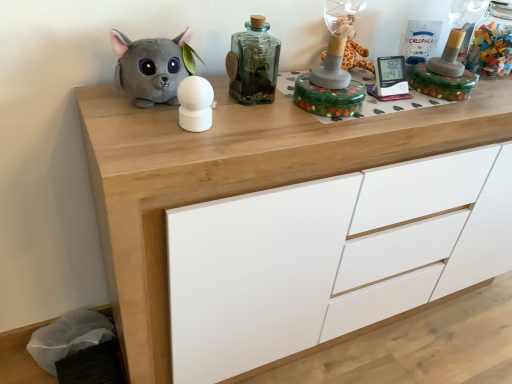
Question: From the image's perspective, is gray plush toy at left, which ranks as the 1th toy in left-to-right order, on wooden chest of drawers at center?

Choices:
 (A) yes
 (B) no

Answer: (A)

Question: Considering the relative sizes of gray plush toy at left, which ranks as the 1th toy in left-to-right order, and wooden chest of drawers at center in the image provided, is gray plush toy at left, which ranks as the 1th toy in left-to-right order, bigger than wooden chest of drawers at center?

Choices:
 (A) no
 (B) yes

Answer: (A)

Question: Is gray plush toy at left, the third toy in the right-to-left sequence, positioned in front of wooden chest of drawers at center?

Choices:
 (A) yes
 (B) no

Answer: (B)

Question: Is gray plush toy at left, which ranks as the 1th toy in left-to-right order, at the right side of wooden chest of drawers at center?

Choices:
 (A) no
 (B) yes

Answer: (A)

Question: Considering the relative positions of gray plush toy at left, the third toy in the right-to-left sequence, and wooden chest of drawers at center in the image provided, is gray plush toy at left, the third toy in the right-to-left sequence, behind wooden chest of drawers at center?

Choices:
 (A) no
 (B) yes

Answer: (B)

Question: Does point (163, 74) appear closer or farther from the camera than point (257, 29)?

Choices:
 (A) closer
 (B) farther

Answer: (A)

Question: From the image's perspective, relative to translucent glass bottle at center, the first bottle when ordered from left to right, is gray plush toy at left, the third toy in the right-to-left sequence, above or below?

Choices:
 (A) above
 (B) below

Answer: (B)

Question: Based on their positions, is gray plush toy at left, which ranks as the 1th toy in left-to-right order, located to the left or right of translucent glass bottle at center, marked as the second bottle in a right-to-left arrangement?

Choices:
 (A) left
 (B) right

Answer: (A)

Question: Is gray plush toy at left, the third toy in the right-to-left sequence, bigger or smaller than translucent glass bottle at center, the 2th bottle when ordered from back to front?

Choices:
 (A) small
 (B) big

Answer: (B)

Question: In terms of size, does green floral box at center, acting as the 1th toy starting from the right, appear bigger or smaller than translucent glass bottle at center, the 1th bottle positioned from the front?

Choices:
 (A) small
 (B) big

Answer: (B)

Question: From a real-world perspective, is green floral box at center, acting as the 1th toy starting from the right, positioned above or below translucent glass bottle at center, the 2th bottle when ordered from back to front?

Choices:
 (A) above
 (B) below

Answer: (B)

Question: In the image, is green floral box at center, acting as the 1th toy starting from the right, positioned in front of or behind translucent glass bottle at center, the 2th bottle when ordered from back to front?

Choices:
 (A) front
 (B) behind

Answer: (A)

Question: Is green floral box at center, acting as the 1th toy starting from the right, inside or outside of translucent glass bottle at center, the first bottle when ordered from left to right?

Choices:
 (A) inside
 (B) outside

Answer: (B)

Question: Based on their positions, is wooden chest of drawers at center located to the left or right of white matte sphere at center, which is the 2th toy from right to left?

Choices:
 (A) right
 (B) left

Answer: (A)

Question: Considering their positions, is wooden chest of drawers at center located in front of or behind white matte sphere at center, the 2th toy from the left?

Choices:
 (A) front
 (B) behind

Answer: (A)